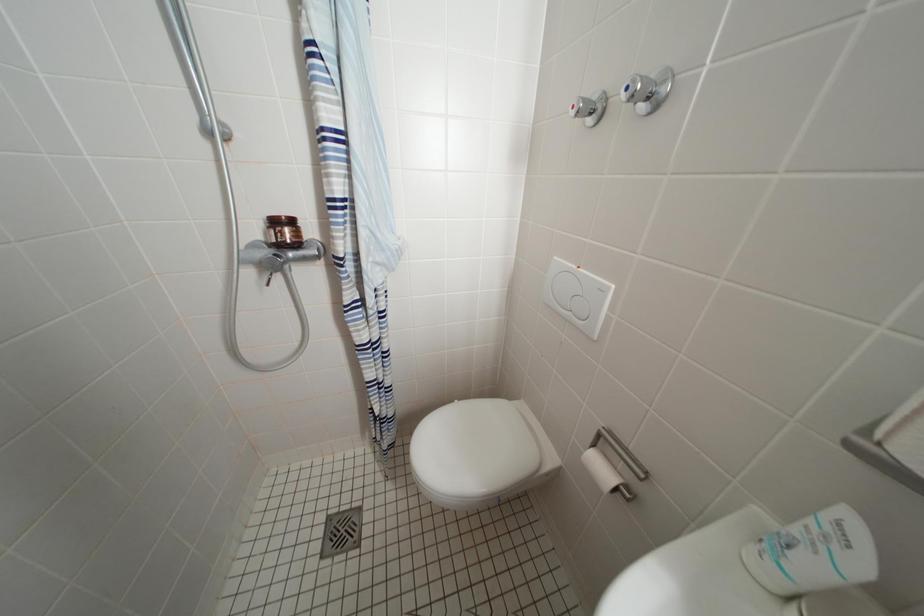
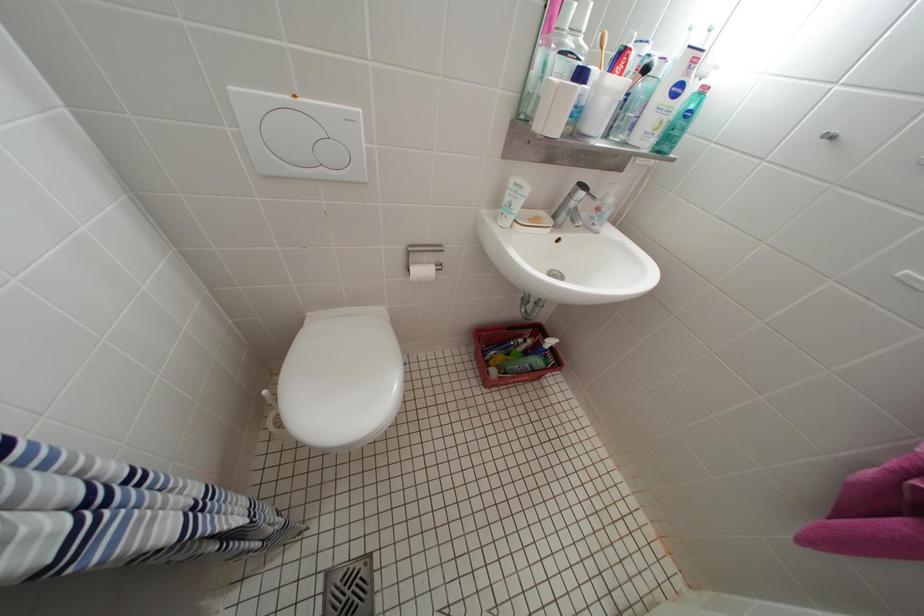
The images are taken continuously from a first-person perspective. In which direction is your viewpoint rotating?

The rotation direction of the camera is right-down.